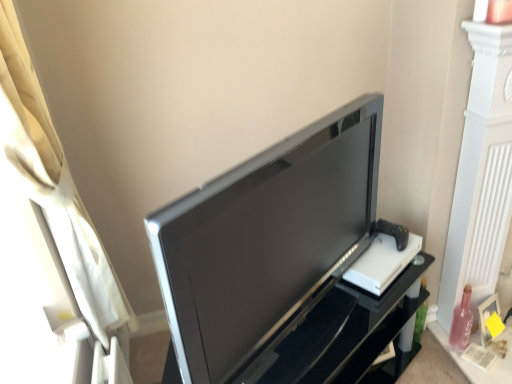
What do you see at coordinates (462, 321) in the screenshot? I see `pink glass bottle at lower right` at bounding box center [462, 321].

You are a GUI agent. You are given a task and a screenshot of the screen. Output one action in this format:
    pyautogui.click(x=<x>, y=<y>)
    Task: Click on the white fabric curtain at left
    This screenshot has width=512, height=384.
    Given the screenshot: What is the action you would take?
    pyautogui.click(x=50, y=244)

Which point is more distant from viewer, (x=124, y=356) or (x=289, y=235)?

The point (x=124, y=356) is farther.

Considering the relative sizes of white fabric curtain at left and satin black television at center in the image provided, is white fabric curtain at left thinner than satin black television at center?

Indeed, white fabric curtain at left has a lesser width compared to satin black television at center.

Considering the relative sizes of white fabric curtain at left and satin black television at center in the image provided, is white fabric curtain at left bigger than satin black television at center?

Yes.

Image resolution: width=512 pixels, height=384 pixels. In order to click on curtain that appears on the left of satin black television at center in this screenshot , I will do `click(50, 244)`.

Consider the image. From a real-world perspective, is white fabric curtain at left below satin black tv at center?

No, from a real-world perspective, white fabric curtain at left is not under satin black tv at center.

Does point (38, 352) appear closer or farther from the camera than point (359, 316)?

Point (38, 352) is positioned closer to the camera compared to point (359, 316).

Which object is further away from the camera, white fabric curtain at left or satin black tv at center?

Positioned behind is satin black tv at center.

Which of these two, white fabric curtain at left or satin black tv at center, stands shorter?

satin black tv at center is shorter.

From a real-world perspective, is pink glass bottle at lower right positioned above or below satin black television at center?

From a real-world perspective, pink glass bottle at lower right is physically below satin black television at center.

Which of these two, pink glass bottle at lower right or satin black television at center, is bigger?

With larger size is satin black television at center.

Are pink glass bottle at lower right and satin black television at center making contact?

No.

From a real-world perspective, who is located lower, satin black tv at center or pink glass bottle at lower right?

pink glass bottle at lower right is physically lower.

Can you confirm if satin black tv at center is shorter than pink glass bottle at lower right?

Incorrect, the height of satin black tv at center does not fall short of that of pink glass bottle at lower right.

Which point is more forward, (328, 322) or (454, 340)?

Positioned in front is point (328, 322).

Is satin black tv at center positioned with its back to pink glass bottle at lower right?

No, satin black tv at center is not facing away from pink glass bottle at lower right.

Which object is positioned more to the left, pink glass bottle at lower right or white fabric curtain at left?

white fabric curtain at left.

Is pink glass bottle at lower right in contact with white fabric curtain at left?

No, pink glass bottle at lower right is not with white fabric curtain at left.

Is point (459, 307) positioned before point (37, 317)?

No, it is behind (37, 317).

How many degrees apart are the facing directions of pink glass bottle at lower right and white fabric curtain at left?

The angular difference between pink glass bottle at lower right and white fabric curtain at left is 62.7 degrees.

Which is in front, white fabric curtain at left or pink glass bottle at lower right?

white fabric curtain at left is more forward.

From the picture: Does white fabric curtain at left have a lesser height compared to pink glass bottle at lower right?

No.

Considering the positions of point (56, 315) and point (470, 294), is point (56, 315) closer or farther from the camera than point (470, 294)?

Point (56, 315) is closer to the camera than point (470, 294).

Is pink glass bottle at lower right surrounded by white fabric curtain at left?

No.

In the image, is satin black television at center positioned in front of or behind satin black tv at center?

Visually, satin black television at center is located in front of satin black tv at center.

How many degrees apart are the facing directions of satin black television at center and satin black tv at center?

3.61 degrees separate the facing orientations of satin black television at center and satin black tv at center.

Is satin black tv at center located within satin black television at center?

Definitely not — satin black tv at center is not inside satin black television at center.

How distant is satin black television at center from satin black tv at center?

satin black television at center is 10.20 inches from satin black tv at center.

What are the coordinates of `television to the right of white fabric curtain at left` in the screenshot? It's located at (266, 242).

Locate an element on the screen. The height and width of the screenshot is (384, 512). furniture that appears below the white fabric curtain at left (from the image's perspective) is located at coordinates (339, 334).

Looking at the image, which one is located closer to satin black television at center, satin black tv at center or white fabric curtain at left?

satin black tv at center is closer to satin black television at center.

Estimate the real-world distances between objects in this image. Which object is further from white fabric curtain at left, pink glass bottle at lower right or satin black tv at center?

pink glass bottle at lower right.

Looking at the image, which one is located closer to pink glass bottle at lower right, satin black tv at center or satin black television at center?

Among the two, satin black tv at center is located nearer to pink glass bottle at lower right.

Looking at this image, estimate the real-world distances between objects in this image. Which object is closer to satin black television at center, pink glass bottle at lower right or satin black tv at center?

satin black tv at center.

From the image, which object appears to be nearer to pink glass bottle at lower right, satin black television at center or white fabric curtain at left?

Among the two, satin black television at center is located nearer to pink glass bottle at lower right.

When comparing their distances from satin black tv at center, does white fabric curtain at left or pink glass bottle at lower right seem closer?

Based on the image, pink glass bottle at lower right appears to be nearer to satin black tv at center.

Considering their positions, is white fabric curtain at left positioned closer to satin black tv at center than satin black television at center?

Among the two, satin black television at center is located nearer to satin black tv at center.

Looking at the image, which one is located closer to pink glass bottle at lower right, white fabric curtain at left or satin black tv at center?

satin black tv at center lies closer to pink glass bottle at lower right than the other object.

You are a GUI agent. You are given a task and a screenshot of the screen. Output one action in this format:
    pyautogui.click(x=<x>, y=<y>)
    Task: Click on the furniture between satin black television at center and pink glass bottle at lower right from front to back
    The image size is (512, 384).
    Given the screenshot: What is the action you would take?
    pyautogui.click(x=339, y=334)

Locate an element on the screen. television between white fabric curtain at left and satin black tv at center in the horizontal direction is located at coordinates (266, 242).

Find the location of `furniture between white fabric curtain at left and pink glass bottle at lower right in the horizontal direction`. furniture between white fabric curtain at left and pink glass bottle at lower right in the horizontal direction is located at coordinates (339, 334).

This screenshot has height=384, width=512. I want to click on television located between white fabric curtain at left and pink glass bottle at lower right in the left-right direction, so click(266, 242).